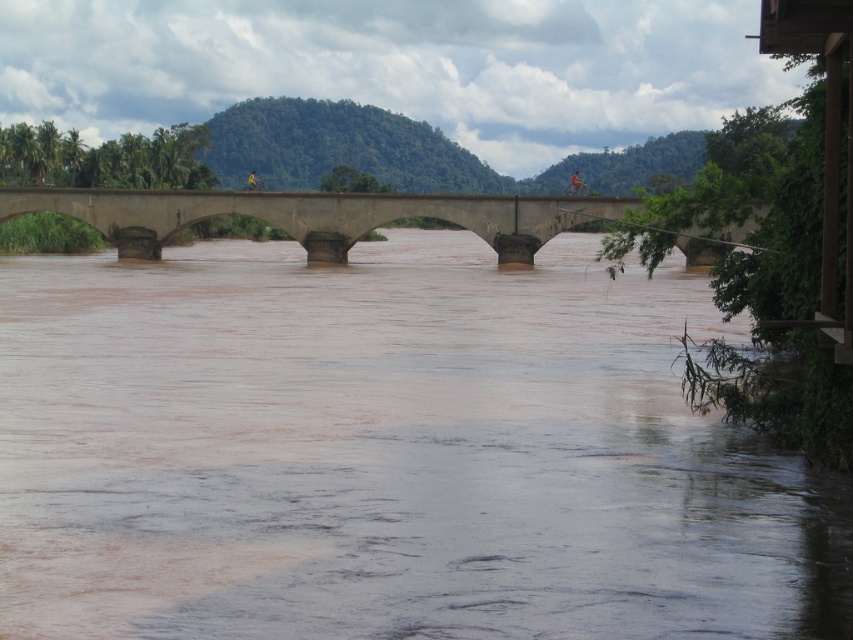
Can you confirm if brown muddy water at center is positioned to the right of concrete bridge at center?

Incorrect, brown muddy water at center is not on the right side of concrete bridge at center.

This screenshot has height=640, width=853. Describe the element at coordinates (387, 452) in the screenshot. I see `brown muddy water at center` at that location.

Is point (506, 392) positioned behind point (256, 214)?

No, (506, 392) is closer to viewer.

Locate an element on the screen. This screenshot has width=853, height=640. brown muddy water at center is located at coordinates (387, 452).